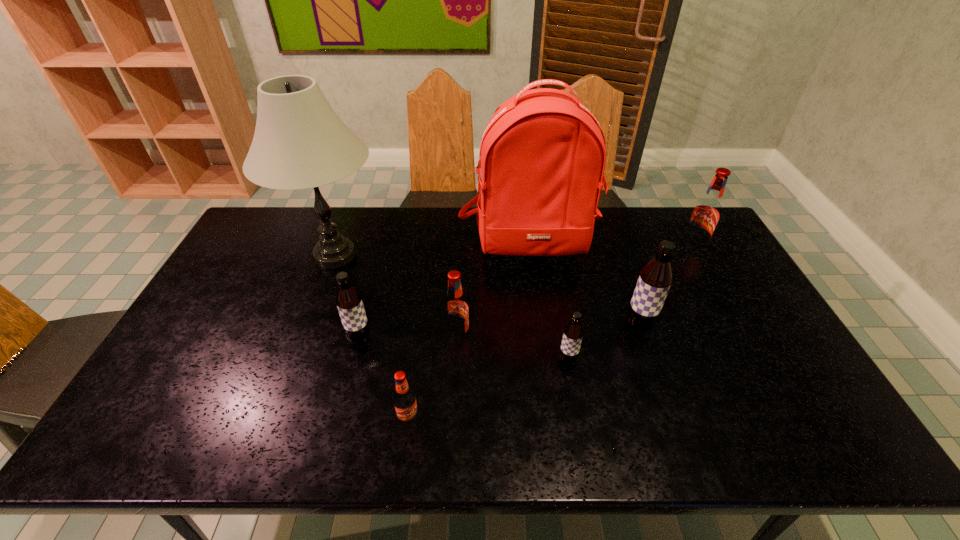
What are the coordinates of `lamp` in the screenshot? It's located at (299, 142).

Identify the location of red backpack. The height and width of the screenshot is (540, 960). [x=542, y=157].

What are the coordinates of `the farthest red root beer` in the screenshot? It's located at (706, 213).

Image resolution: width=960 pixels, height=540 pixels. I want to click on the rightmost red root beer, so click(x=706, y=213).

The height and width of the screenshot is (540, 960). I want to click on the rightmost brown root beer, so click(655, 279).

Find the location of a particular element. The height and width of the screenshot is (540, 960). the biggest brown root beer is located at coordinates (655, 279).

Locate an element on the screen. the third root beer from left to right is located at coordinates (456, 314).

The image size is (960, 540). I want to click on the second smallest red root beer, so click(x=456, y=314).

Locate an element on the screen. the leftmost brown root beer is located at coordinates (348, 299).

The image size is (960, 540). In order to click on the leftmost root beer in this screenshot , I will do `click(348, 299)`.